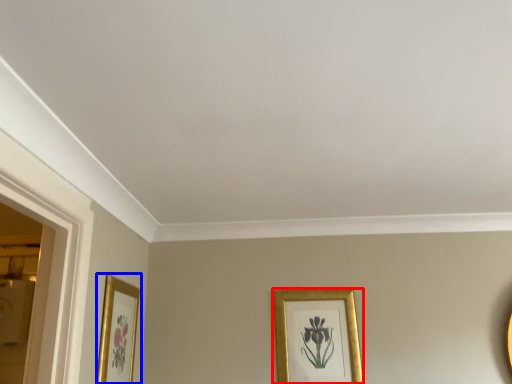
Question: Which of the following is the farthest to the observer, picture frame (highlighted by a red box) or picture frame (highlighted by a blue box)?

Choices:
 (A) picture frame
 (B) picture frame

Answer: (A)